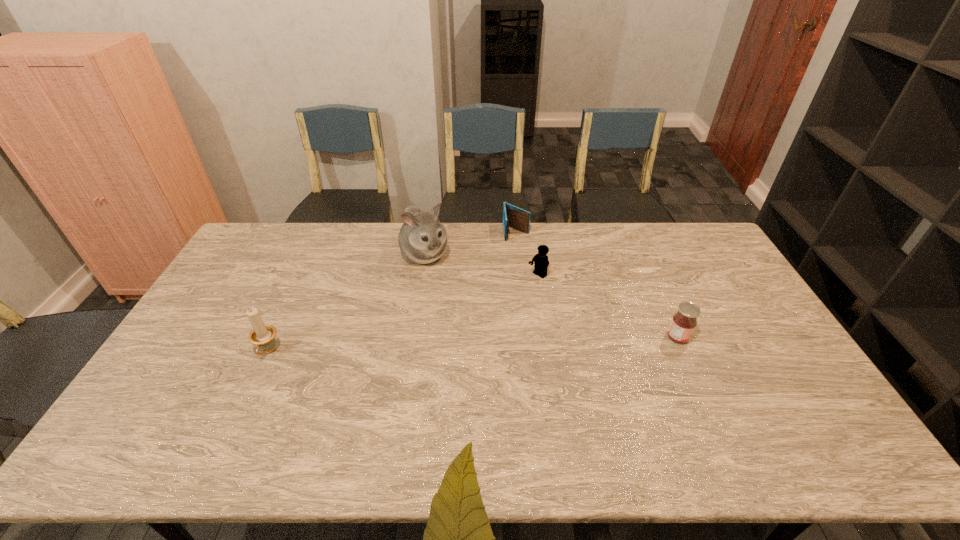
Identify the location of vacant space situated 0.050m on the front-facing side of the Lego. (522, 288).

The width and height of the screenshot is (960, 540). I want to click on vacant space located on the front-facing side of the Lego, so click(x=520, y=289).

Where is `free region located on the face of the hamster`? free region located on the face of the hamster is located at coordinates (449, 291).

What are the coordinates of `free region located on the face of the hamster` in the screenshot? It's located at (457, 301).

Where is `vacant space located on the face of the hamster`? The height and width of the screenshot is (540, 960). vacant space located on the face of the hamster is located at coordinates (444, 284).

I want to click on vacant space located 0.110m on the exterior surface of the wallet, so click(520, 260).

Where is `vacant space located 0.310m on the exterior surface of the wallet`? This screenshot has height=540, width=960. vacant space located 0.310m on the exterior surface of the wallet is located at coordinates (526, 299).

Find the location of a particular element. Image resolution: width=960 pixels, height=540 pixels. blank space located on the exterior surface of the wallet is located at coordinates (525, 294).

Where is `hamster present at the far edge`? hamster present at the far edge is located at coordinates (422, 239).

This screenshot has width=960, height=540. In order to click on wallet at the far edge in this screenshot , I will do `click(514, 217)`.